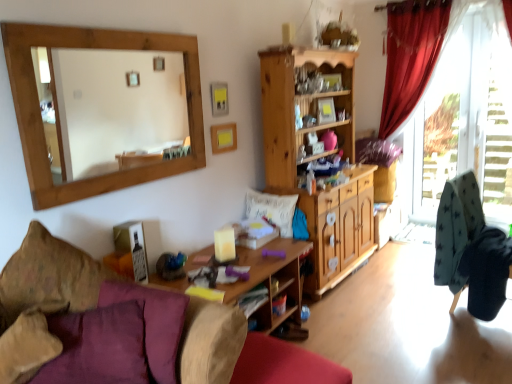
Question: Is transparent glass door at right thinner than woodenmaterial/texturetable at center?

Choices:
 (A) yes
 (B) no

Answer: (A)

Question: Would you say transparent glass door at right is outside woodenmaterial/texturetable at center?

Choices:
 (A) yes
 (B) no

Answer: (A)

Question: Does transparent glass door at right appear on the right side of woodenmaterial/texturetable at center?

Choices:
 (A) yes
 (B) no

Answer: (A)

Question: Considering the relative sizes of transparent glass door at right and woodenmaterial/texturetable at center in the image provided, is transparent glass door at right taller than woodenmaterial/texturetable at center?

Choices:
 (A) yes
 (B) no

Answer: (A)

Question: Considering the relative positions of transparent glass door at right and woodenmaterial/texturetable at center in the image provided, is transparent glass door at right to the left of woodenmaterial/texturetable at center from the viewer's perspective?

Choices:
 (A) no
 (B) yes

Answer: (A)

Question: From a real-world perspective, does transparent glass door at right sit lower than woodenmaterial/texturetable at center?

Choices:
 (A) yes
 (B) no

Answer: (B)

Question: Does red velvet curtain at right appear on the right side of wooden mirror at upper left?

Choices:
 (A) yes
 (B) no

Answer: (A)

Question: Can you confirm if red velvet curtain at right is shorter than wooden mirror at upper left?

Choices:
 (A) yes
 (B) no

Answer: (B)

Question: From a real-world perspective, is red velvet curtain at right physically below wooden mirror at upper left?

Choices:
 (A) yes
 (B) no

Answer: (A)

Question: Considering the relative sizes of red velvet curtain at right and wooden mirror at upper left in the image provided, is red velvet curtain at right taller than wooden mirror at upper left?

Choices:
 (A) yes
 (B) no

Answer: (A)

Question: From the image's perspective, does red velvet curtain at right appear higher than wooden mirror at upper left?

Choices:
 (A) yes
 (B) no

Answer: (A)

Question: From the image's perspective, is red velvet curtain at right located beneath wooden mirror at upper left?

Choices:
 (A) no
 (B) yes

Answer: (A)

Question: From a real-world perspective, is wooden mirror at upper left positioned over red velvet curtain at right based on gravity?

Choices:
 (A) yes
 (B) no

Answer: (A)